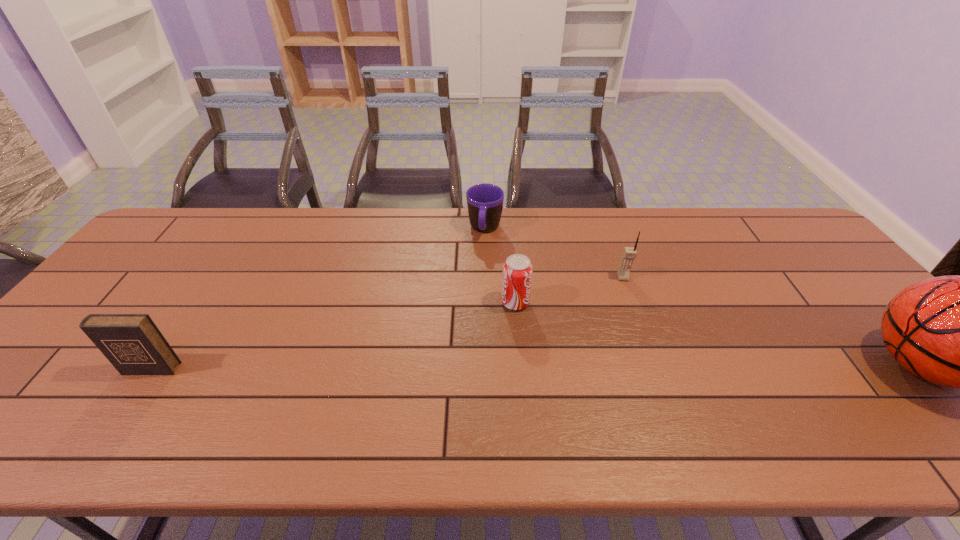
In order to click on the leftmost object in this screenshot , I will do tap(132, 343).

You are a GUI agent. You are given a task and a screenshot of the screen. Output one action in this format:
    pyautogui.click(x=<x>, y=<y>)
    Task: Click on the soda can
    The width and height of the screenshot is (960, 540).
    Given the screenshot: What is the action you would take?
    pyautogui.click(x=517, y=270)

The image size is (960, 540). Find the location of `the shortest object`. the shortest object is located at coordinates [x=485, y=202].

Find the location of a particular element. The height and width of the screenshot is (540, 960). the farthest object is located at coordinates (485, 202).

Identify the location of the second farthest object. (629, 253).

Identify the location of cellular telephone. This screenshot has height=540, width=960. (629, 253).

The width and height of the screenshot is (960, 540). I want to click on vacant space positioned 0.340m on the logo side of the soda can, so click(650, 371).

At what (x,y) coordinates should I click in order to perform the action: click on vacant region located 0.130m on the logo side of the soda can. Please return your answer as a coordinate pair (x, y). This screenshot has width=960, height=540. Looking at the image, I should click on (570, 330).

I want to click on free space located on the logo side of the soda can, so click(x=584, y=338).

I want to click on vacant space situated 0.300m with the handle on the side of the farthest object, so click(x=472, y=315).